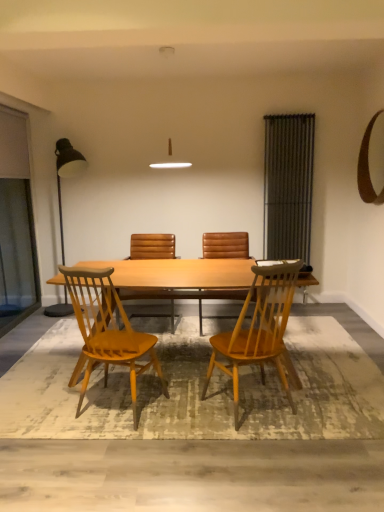
Where is `vacant space situated on the left part of light brown wood chair at center, which is counted as the 4th chair, starting from the back`? This screenshot has height=512, width=384. vacant space situated on the left part of light brown wood chair at center, which is counted as the 4th chair, starting from the back is located at coordinates (186, 412).